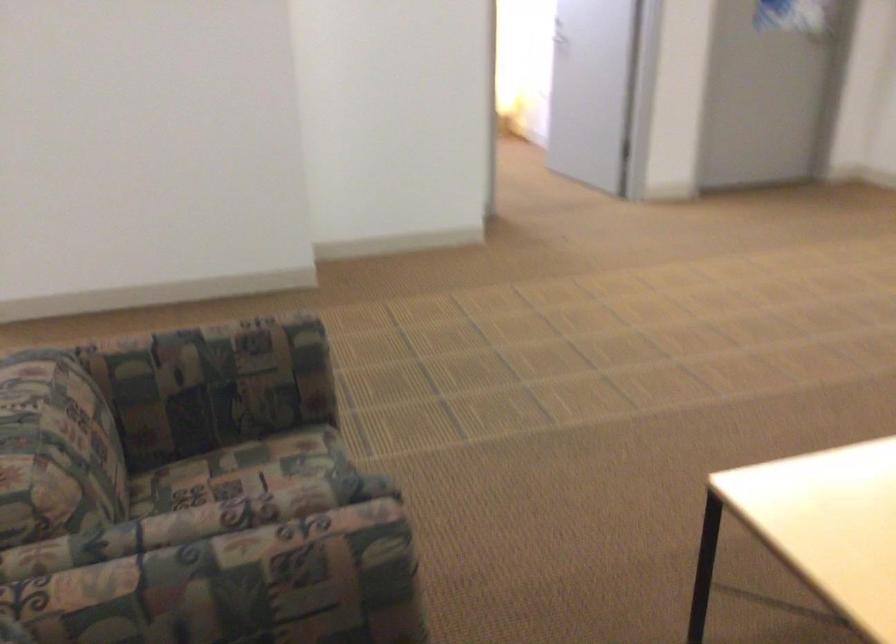
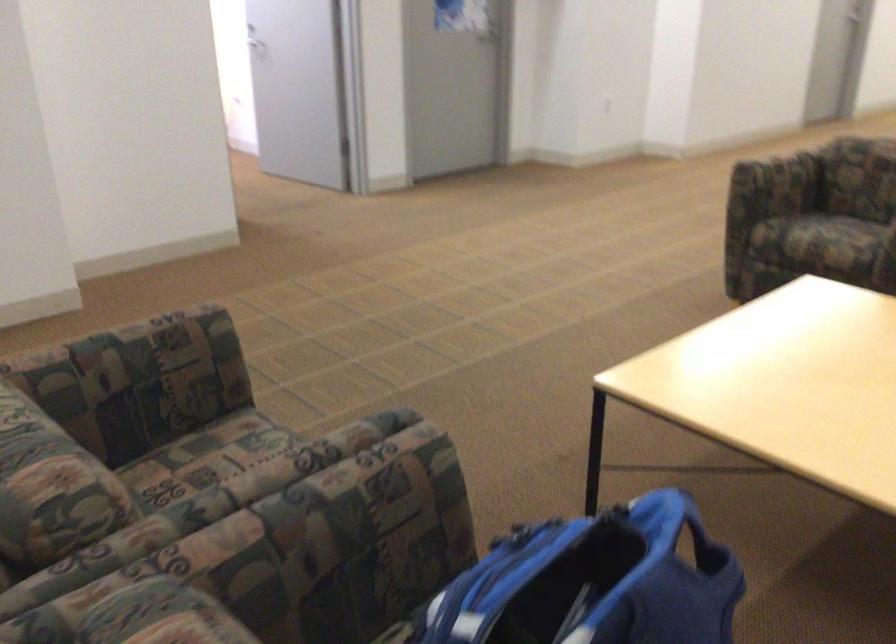
Question: The camera is either moving clockwise (left) or counter-clockwise (right) around the object. The first image is from the beginning of the video and the second image is from the end. Is the camera moving left or right when shooting the video?

Choices:
 (A) Left
 (B) Right

Answer: (A)